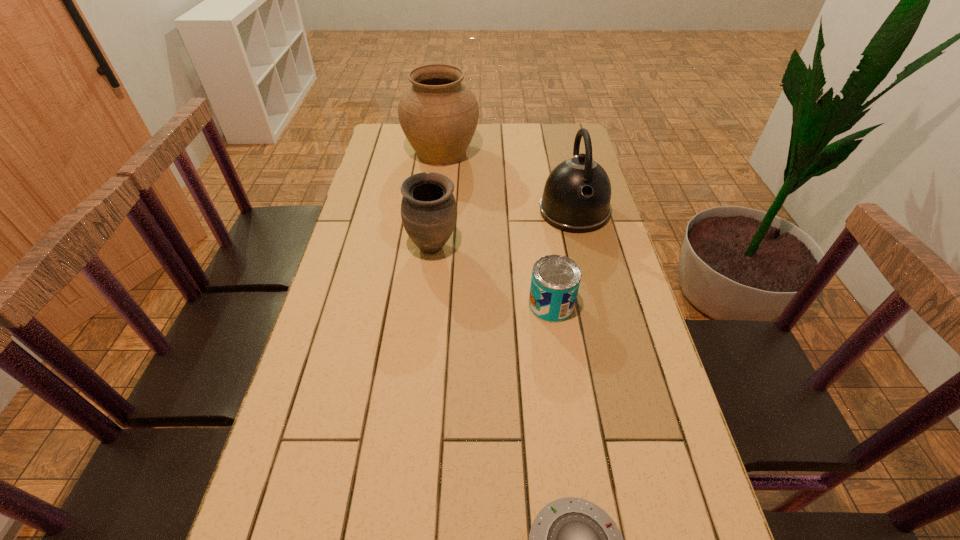
This screenshot has width=960, height=540. I want to click on the farther urn, so click(438, 114).

Locate an element on the screen. the taller urn is located at coordinates tap(438, 114).

Locate an element on the screen. The image size is (960, 540). kettle is located at coordinates point(576,199).

Identify the location of the third shortest object. Image resolution: width=960 pixels, height=540 pixels. (428, 209).

The height and width of the screenshot is (540, 960). Find the location of `the shorter urn`. the shorter urn is located at coordinates (428, 209).

Image resolution: width=960 pixels, height=540 pixels. Find the location of `can`. can is located at coordinates (555, 280).

Locate an element on the screen. The width and height of the screenshot is (960, 540). the fourth tallest object is located at coordinates pos(555,280).

Locate an element on the screen. Image resolution: width=960 pixels, height=540 pixels. free space located 0.060m on the front of the taller urn is located at coordinates (438, 184).

Where is `free space located 0.150m on the spout of the kettle`? This screenshot has width=960, height=540. free space located 0.150m on the spout of the kettle is located at coordinates (588, 272).

What are the coordinates of `vacant space located on the front of the nearer urn` in the screenshot? It's located at (418, 383).